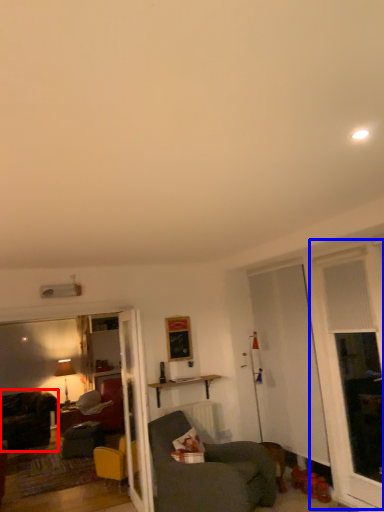
Question: Which point is closer to the camera, chair (highlighted by a red box) or window (highlighted by a blue box)?

Choices:
 (A) chair
 (B) window

Answer: (B)